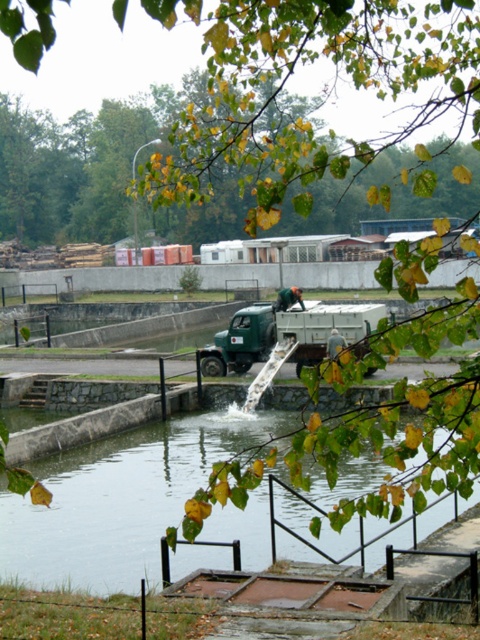
Does clear concrete water at center appear on the left side of green matte truck at center?

Indeed, clear concrete water at center is positioned on the left side of green matte truck at center.

You are a GUI agent. You are given a task and a screenshot of the screen. Output one action in this format:
    pyautogui.click(x=<x>, y=<y>)
    Task: Click on the clear concrete water at center
    The height and width of the screenshot is (640, 480).
    Given the screenshot: What is the action you would take?
    120,499